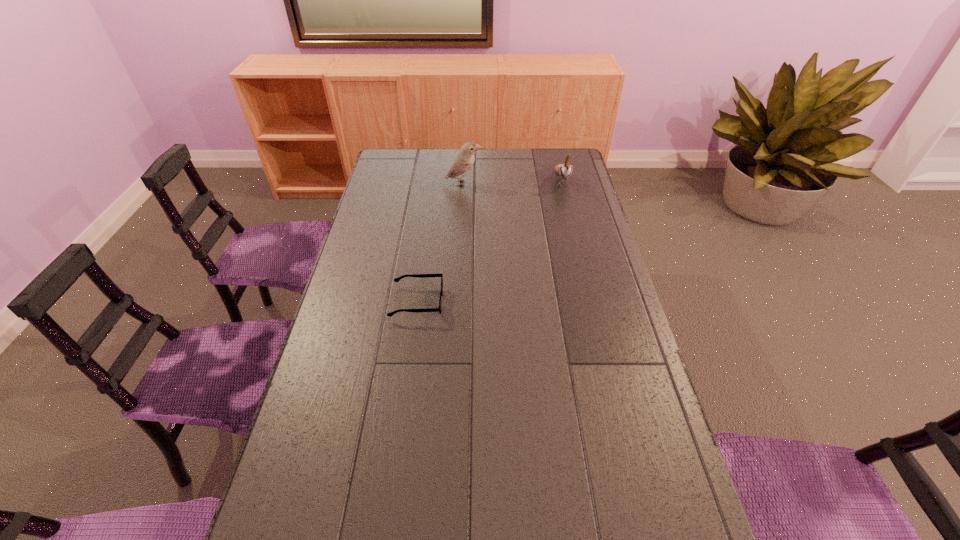
Find the location of a particular element. The image size is (960, 540). vacant region at the far edge of the desktop is located at coordinates (476, 163).

This screenshot has width=960, height=540. In order to click on vacant region at the left edge of the desktop in this screenshot , I will do `click(298, 447)`.

Identify the location of vacant space at the right edge. Image resolution: width=960 pixels, height=540 pixels. (x=583, y=221).

Image resolution: width=960 pixels, height=540 pixels. Find the location of `free space that is in between the shortest object and the rightmost object`. free space that is in between the shortest object and the rightmost object is located at coordinates (489, 241).

Locate an element on the screen. free space between the rightmost object and the left bird is located at coordinates (512, 181).

The height and width of the screenshot is (540, 960). Find the location of `vacant space in between the rightmost object and the shortest object`. vacant space in between the rightmost object and the shortest object is located at coordinates (489, 241).

Locate an element on the screen. free space between the shortest object and the right bird is located at coordinates (489, 241).

Where is `empty location between the shortest object and the rightmost object`? empty location between the shortest object and the rightmost object is located at coordinates (489, 241).

The image size is (960, 540). I want to click on vacant area between the shortest object and the rightmost object, so click(x=489, y=241).

Locate an element on the screen. This screenshot has width=960, height=540. free space between the left bird and the right bird is located at coordinates (512, 181).